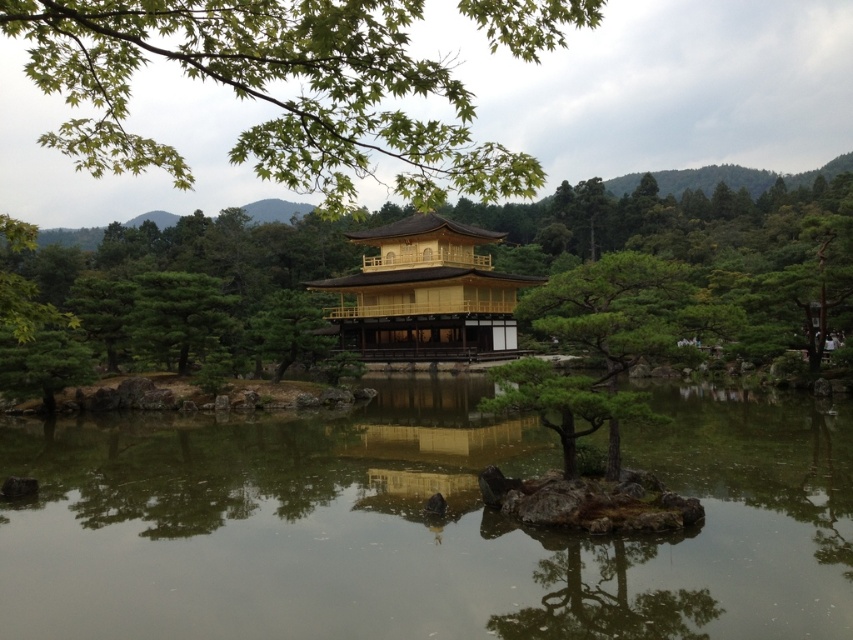
Question: Is green leafy branch at upper center positioned at the back of green matte tree at center?

Choices:
 (A) yes
 (B) no

Answer: (B)

Question: Among these objects, which one is farthest from the camera?

Choices:
 (A) transparent water at center
 (B) green leafy branch at upper center
 (C) green textured tree at center
 (D) green matte tree at center

Answer: (C)

Question: Can you confirm if green leafy branch at upper center is positioned to the right of green matte tree at center?

Choices:
 (A) no
 (B) yes

Answer: (A)

Question: Based on their relative distances, which object is nearer to the green textured tree at center?

Choices:
 (A) golden polished wood temple at center
 (B) green leafy branch at upper center

Answer: (A)

Question: Which point appears closest to the camera in this image?

Choices:
 (A) (415, 304)
 (B) (584, 378)
 (C) (502, 166)

Answer: (C)

Question: Can you confirm if green textured tree at center is positioned below green matte tree at center?

Choices:
 (A) yes
 (B) no

Answer: (B)